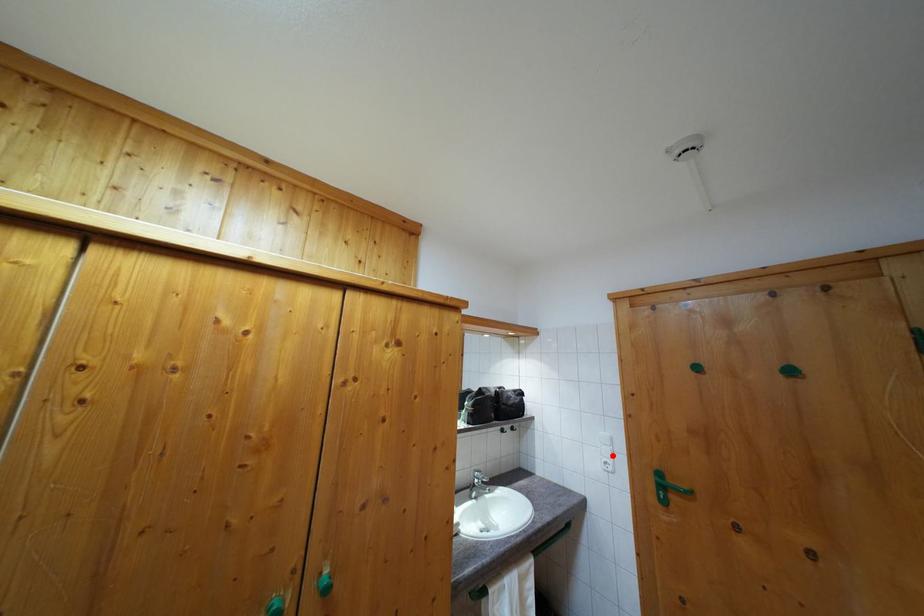
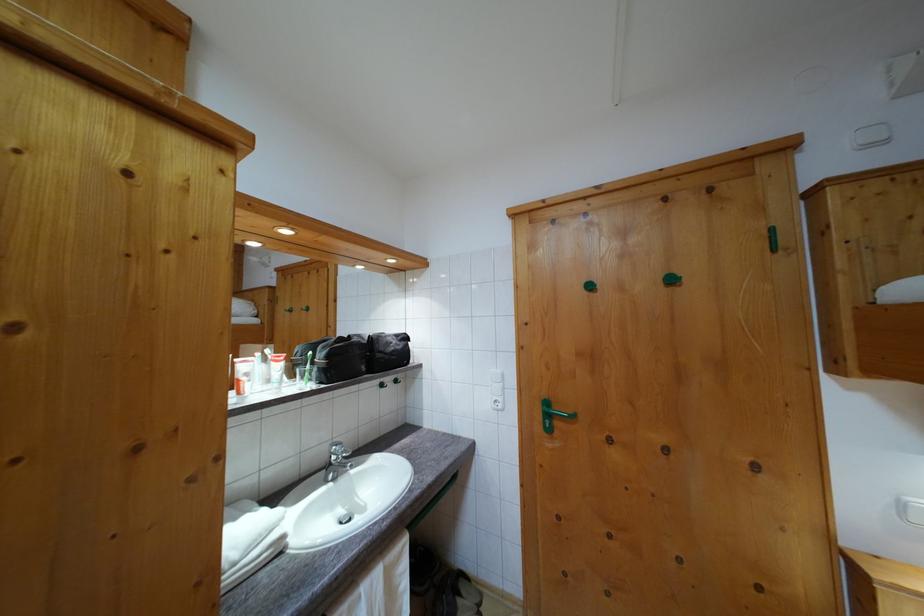
Find the pixel in the second image that matches the highlighted location in the first image.

(504, 392)